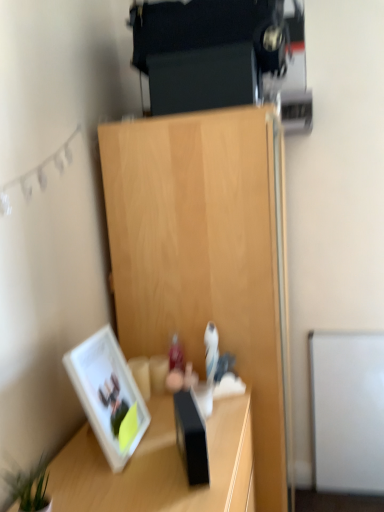
Find the location of a particular element. Image resolution: width=384 pixels, height=512 pixels. vacant area that is situated to the right of white glossy picture frame at lower left is located at coordinates (163, 444).